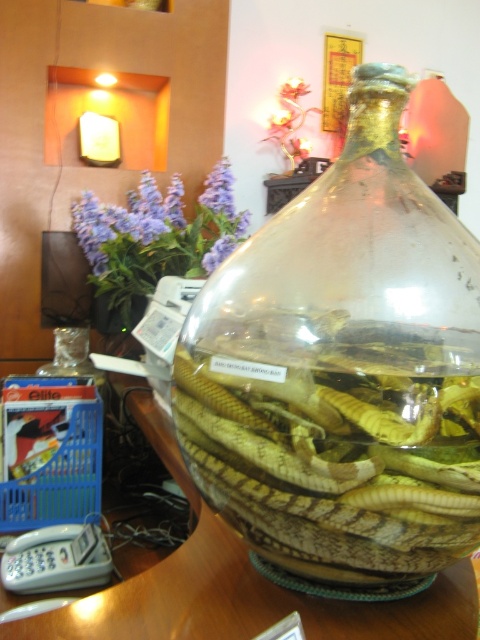
Question: Can you confirm if transparent glass jar at center is positioned above wooden table at center?

Choices:
 (A) no
 (B) yes

Answer: (B)

Question: Which point is farther to the camera?

Choices:
 (A) (432, 365)
 (B) (192, 563)

Answer: (B)

Question: Can you confirm if transparent glass jar at center is thinner than wooden table at center?

Choices:
 (A) yes
 (B) no

Answer: (A)

Question: Does transparent glass jar at center have a larger size compared to wooden table at center?

Choices:
 (A) no
 (B) yes

Answer: (A)

Question: Which object appears farthest from the camera in this image?

Choices:
 (A) wooden table at center
 (B) transparent glass jar at center

Answer: (A)